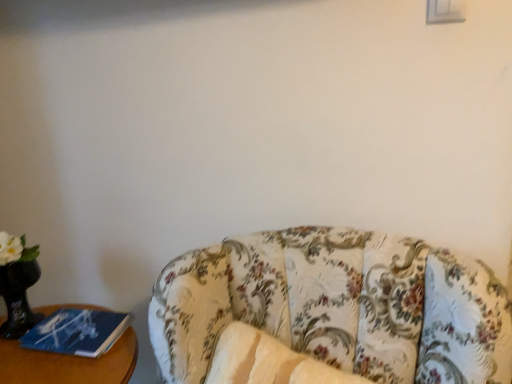
Question: Is blue paper at left thinner than floral fabric couch at lower right?

Choices:
 (A) no
 (B) yes

Answer: (B)

Question: From the image's perspective, is blue paper at left below floral fabric couch at lower right?

Choices:
 (A) yes
 (B) no

Answer: (B)

Question: Is blue paper at left not near floral fabric couch at lower right?

Choices:
 (A) no
 (B) yes

Answer: (A)

Question: Is blue paper at left to the right of floral fabric couch at lower right from the viewer's perspective?

Choices:
 (A) yes
 (B) no

Answer: (B)

Question: Considering the relative sizes of blue paper at left and floral fabric couch at lower right in the image provided, is blue paper at left wider than floral fabric couch at lower right?

Choices:
 (A) yes
 (B) no

Answer: (B)

Question: Would you say blue paper at left contains floral fabric couch at lower right?

Choices:
 (A) no
 (B) yes

Answer: (A)

Question: Is floral fabric couch at lower right further to camera compared to blue paper at left?

Choices:
 (A) yes
 (B) no

Answer: (B)

Question: Does floral fabric couch at lower right turn towards blue paper at left?

Choices:
 (A) no
 (B) yes

Answer: (A)

Question: Can you confirm if floral fabric couch at lower right is wider than blue paper at left?

Choices:
 (A) yes
 (B) no

Answer: (A)

Question: Can you confirm if floral fabric couch at lower right is positioned to the right of blue paper at left?

Choices:
 (A) yes
 (B) no

Answer: (A)

Question: From the image's perspective, is floral fabric couch at lower right on top of blue paper at left?

Choices:
 (A) yes
 (B) no

Answer: (B)

Question: Is floral fabric couch at lower right not inside blue paper at left?

Choices:
 (A) no
 (B) yes

Answer: (B)

Question: Considering the positions of point [425, 332] and point [59, 365], is point [425, 332] closer or farther from the camera than point [59, 365]?

Choices:
 (A) closer
 (B) farther

Answer: (A)